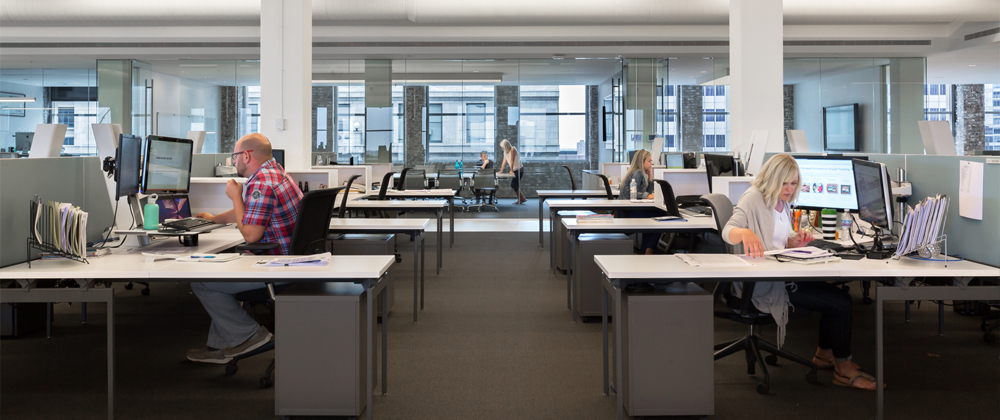
The width and height of the screenshot is (1000, 420). What are the coordinates of `monitor screens` in the screenshot? It's located at 876,200, 823,185, 832,130, 714,165, 672,160, 171,162, 125,181.